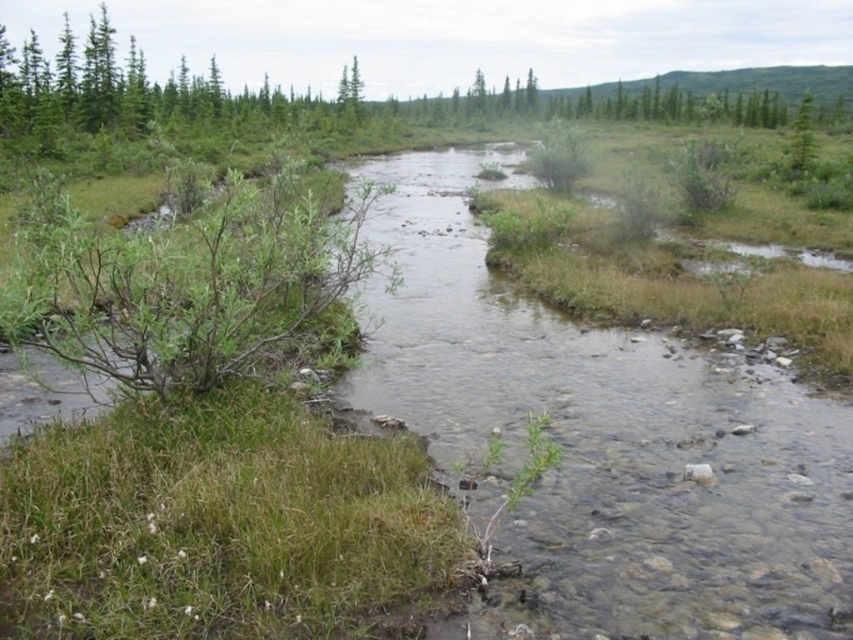
You are a hiker standing at the edge of the stream and looking towards the background. Which object, the clear water at center or the green leafy tree at upper right, appears taller from your perspective?

The green leafy tree at upper right appears taller than the clear water at center from your perspective.